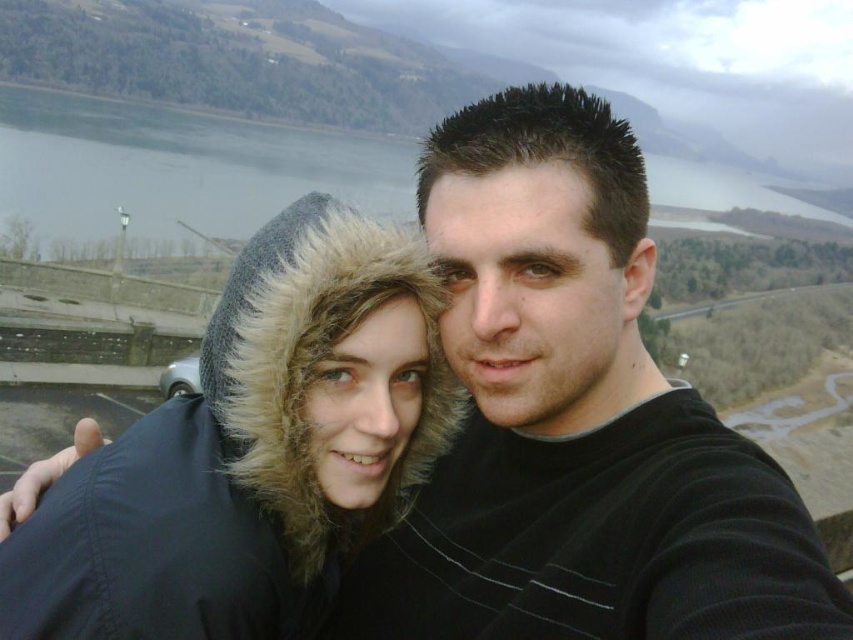
Question: Is black matte shirt at center closer to camera compared to fuzzy fur hood at center?

Choices:
 (A) yes
 (B) no

Answer: (A)

Question: Which object is farther from the camera taking this photo?

Choices:
 (A) black matte shirt at center
 (B) gray water at upper center

Answer: (B)

Question: Among these points, which one is nearest to the camera?

Choices:
 (A) (223, 198)
 (B) (766, 483)
 (C) (381, 340)

Answer: (B)

Question: Which point is closer to the camera?

Choices:
 (A) black matte shirt at center
 (B) gray water at upper center
 (C) fuzzy fur hood at center

Answer: (A)

Question: Does fuzzy fur hood at center have a smaller size compared to gray water at upper center?

Choices:
 (A) no
 (B) yes

Answer: (B)

Question: Can you confirm if black matte shirt at center is positioned to the left of fuzzy fur hood at center?

Choices:
 (A) yes
 (B) no

Answer: (B)